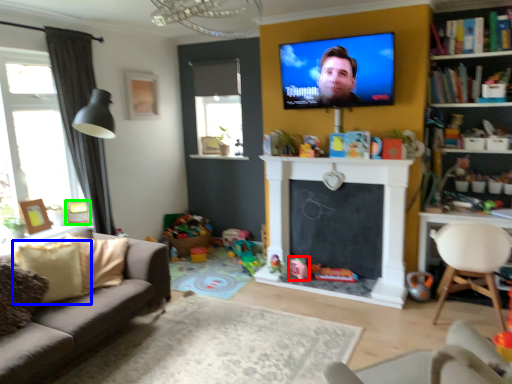
Question: Which object is the closest to the toy (highlighted by a red box)? Choose among these: pillow (highlighted by a blue box) or picture frame (highlighted by a green box).

Choices:
 (A) pillow
 (B) picture frame

Answer: (B)